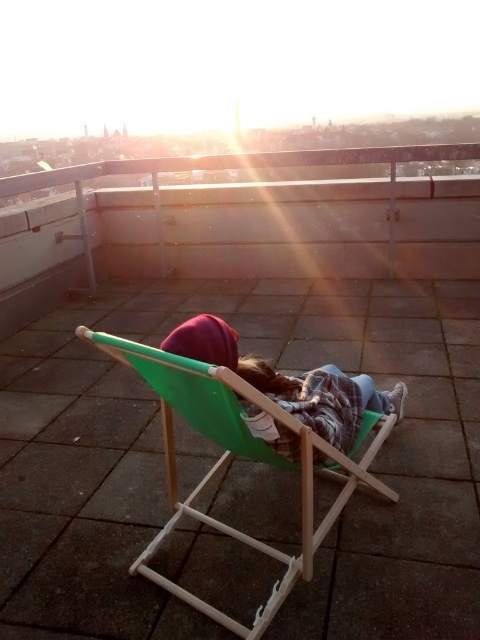
You are planning to set up a small reading nook on the rooftop and have both the green wood beach chair at center and the matte green chair at center. Which chair should you choose if you want the larger one for comfort?

The green wood beach chair at center is bigger than the matte green chair at center, so choose the green wood beach chair at center for a more comfortable seating option.

You are standing on the rooftop and see the point marked at coordinates (232, 458). What object is located at that point?

The green wood beach chair at center is located at the point marked at coordinates (232, 458).

You are a delivery robot that needs to place a small package between the green wood beach chair at center and the matte green chair at center. Can you fit the package in the space between them if the package is 7 inches long?

The green wood beach chair at center is 7.40 inches away from the matte green chair at center. Since the package is 7 inches long, it can fit between them as the space is slightly larger than the package.